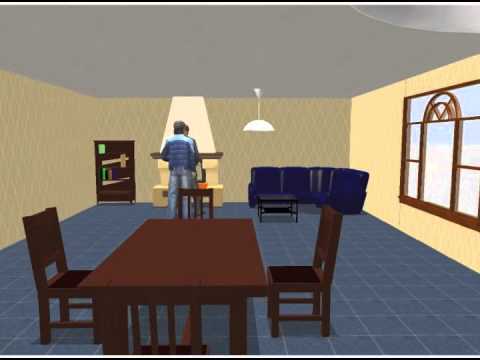
The image size is (480, 360). Find the location of `dresser`. dresser is located at coordinates (93, 173).